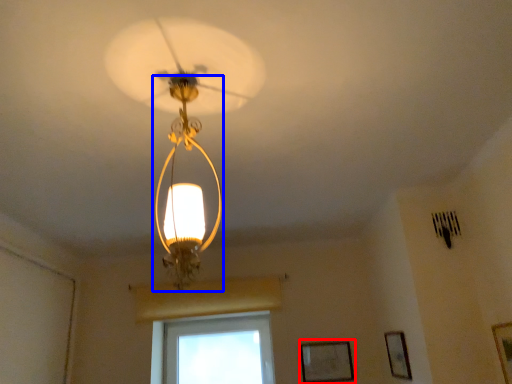
Question: Among these objects, which one is nearest to the camera, picture frame (highlighted by a red box) or light fixture (highlighted by a blue box)?

Choices:
 (A) picture frame
 (B) light fixture

Answer: (B)